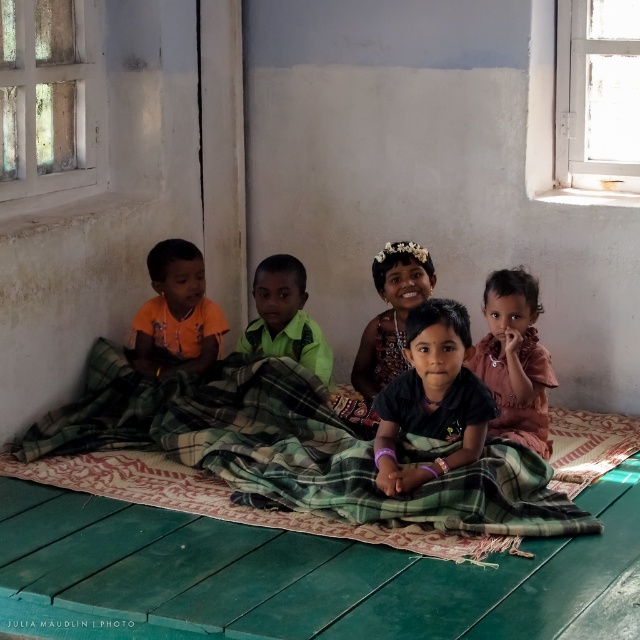
Who is more forward, (x=384, y=502) or (x=369, y=360)?

Point (x=384, y=502)

Can you confirm if green plaid blanket at center is positioned below matte floral headband at center?

Yes.

The height and width of the screenshot is (640, 640). Describe the element at coordinates (291, 449) in the screenshot. I see `green plaid blanket at center` at that location.

Find the location of `green plaid blanket at center`. green plaid blanket at center is located at coordinates (291, 449).

From the picture: Does dark green fabric at center appear under matte pink shirt at center?

Indeed, dark green fabric at center is positioned under matte pink shirt at center.

This screenshot has width=640, height=640. What do you see at coordinates (433, 396) in the screenshot? I see `dark green fabric at center` at bounding box center [433, 396].

Find the location of a particular element. The width and height of the screenshot is (640, 640). dark green fabric at center is located at coordinates (433, 396).

Find the location of `dark green fabric at center`. dark green fabric at center is located at coordinates (433, 396).

Can you confirm if green plaid blanket at center is shorter than dark green fabric at center?

Indeed, green plaid blanket at center has a lesser height compared to dark green fabric at center.

Locate an element on the screen. green plaid blanket at center is located at coordinates (291, 449).

Does point (189, 412) lie in front of point (381, 454)?

No, (189, 412) is behind (381, 454).

Find the location of a particular element. The width and height of the screenshot is (640, 640). green plaid blanket at center is located at coordinates (291, 449).